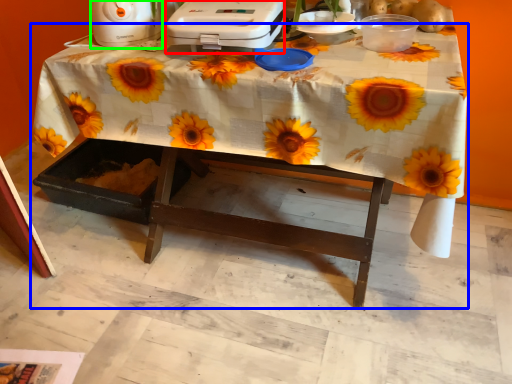
Question: Estimate the real-world distances between objects in this image. Which object is farther from appliance (highlighted by a red box), table (highlighted by a blue box) or appliance (highlighted by a green box)?

Choices:
 (A) table
 (B) appliance

Answer: (B)